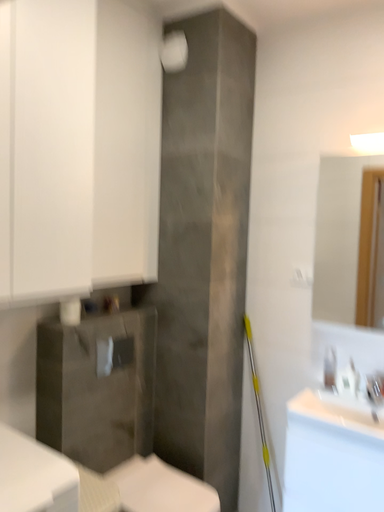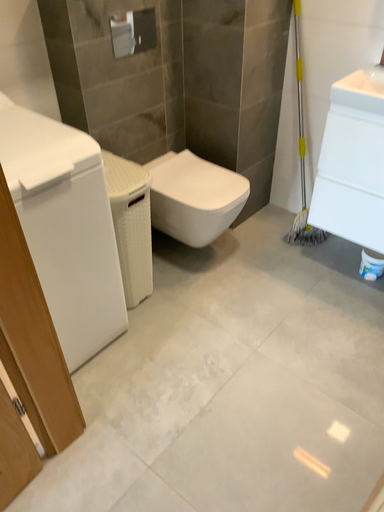
Question: How did the camera likely rotate when shooting the video?

Choices:
 (A) rotated upward
 (B) rotated downward

Answer: (B)